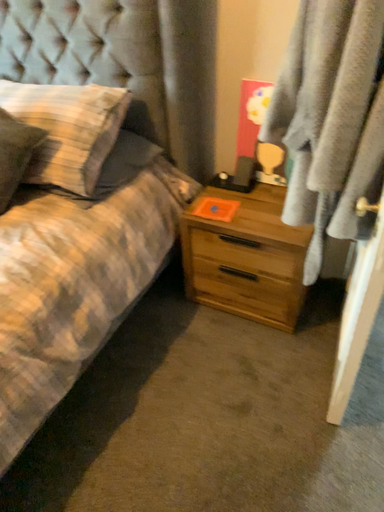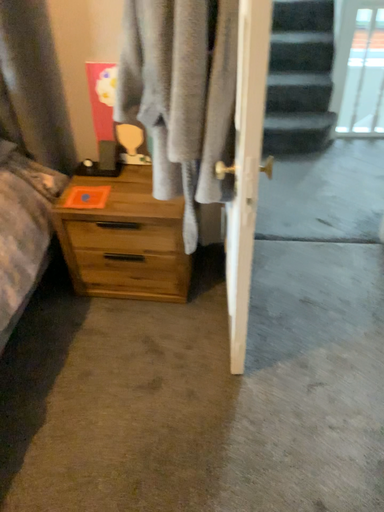
Question: How did the camera likely rotate when shooting the video?

Choices:
 (A) rotated left
 (B) rotated right

Answer: (B)